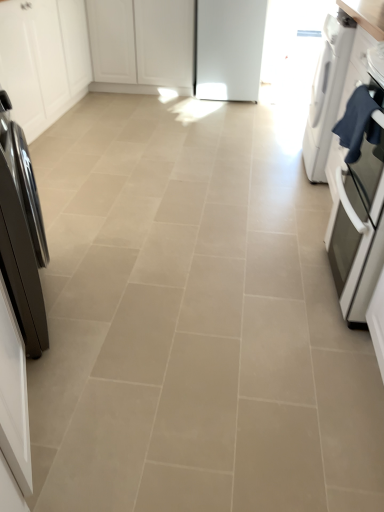
You are a GUI agent. You are given a task and a screenshot of the screen. Output one action in this format:
    pyautogui.click(x=<x>, y=<y>)
    Task: Click on the free space to the right of shiny black refrigerator at left, which is the second home appliance from back to front
    Image resolution: width=384 pixels, height=512 pixels.
    Given the screenshot: What is the action you would take?
    pyautogui.click(x=120, y=315)